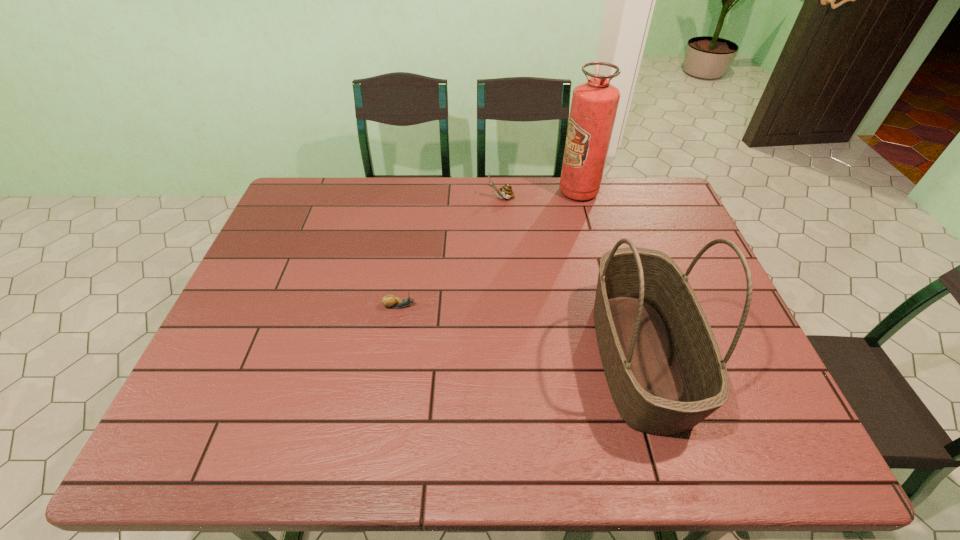
You are a GUI agent. You are given a task and a screenshot of the screen. Output one action in this format:
    pyautogui.click(x=<x>, y=<y>)
    Task: Click on the fire extinguisher
    This screenshot has height=540, width=960.
    Given the screenshot: What is the action you would take?
    pyautogui.click(x=594, y=105)

I want to click on basket, so click(662, 363).

The height and width of the screenshot is (540, 960). In order to click on the second object from left to right in this screenshot , I will do `click(505, 191)`.

At what (x,y) coordinates should I click in order to perform the action: click on the right escargot. Please return your answer as a coordinate pair (x, y). The height and width of the screenshot is (540, 960). Looking at the image, I should click on (505, 191).

Identify the location of the leftmost object. This screenshot has height=540, width=960. (390, 301).

Where is `the nearer escargot`? the nearer escargot is located at coordinates (390, 301).

Identify the location of free space located on the label side of the fire extinguisher. (527, 192).

At what (x,y) coordinates should I click in order to perform the action: click on free spot located on the label side of the fire extinguisher. Please return your answer as a coordinate pair (x, y). The image size is (960, 540). Looking at the image, I should click on (513, 192).

At what (x,y) coordinates should I click in order to perform the action: click on blank space located on the label side of the fire extinguisher. Please return your answer as a coordinate pair (x, y). Image resolution: width=960 pixels, height=540 pixels. Looking at the image, I should click on (464, 192).

This screenshot has width=960, height=540. Find the location of `vacant space located on the left of the second tallest object`. vacant space located on the left of the second tallest object is located at coordinates (466, 356).